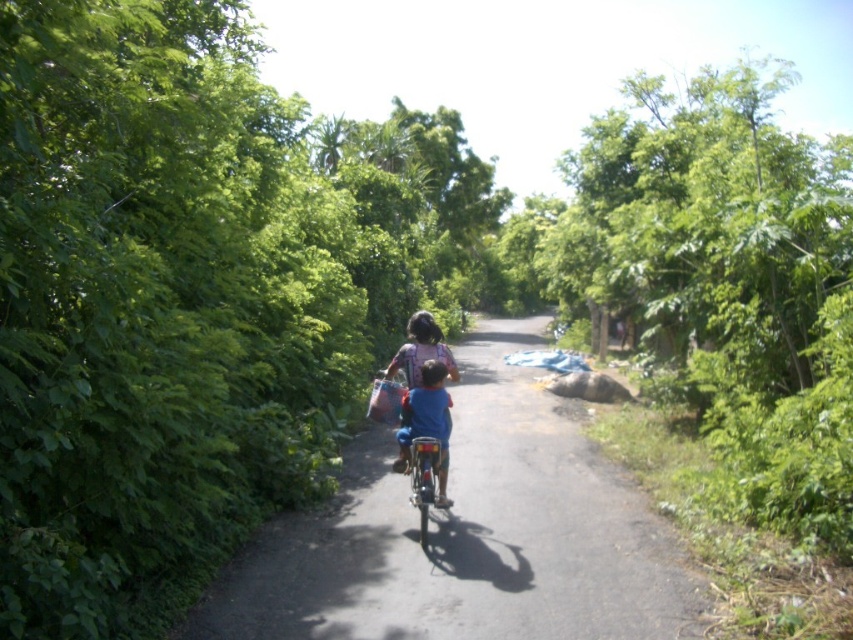
You are standing at the camera position and want to throw a ball to the point marked as point (433, 400). Can you estimate whether the ball will land within 25 feet from you?

The point (433, 400) is 23.27 feet from the camera, so yes, the ball will land within 25 feet from you.